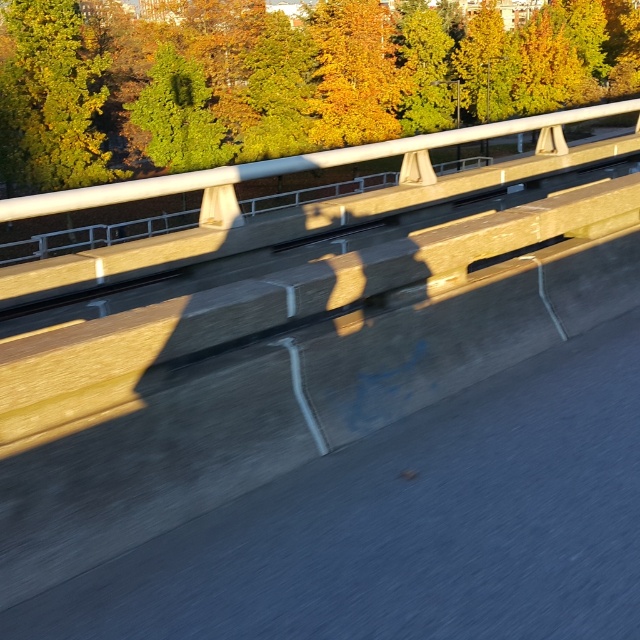
Question: Which point is closer to the camera?

Choices:
 (A) (61, 157)
 (B) (12, 161)

Answer: (B)

Question: Can you confirm if green leafy tree at upper center is smaller than green leafy tree at upper left?

Choices:
 (A) no
 (B) yes

Answer: (A)

Question: Can you confirm if green leafy tree at upper center is wider than green leafy tree at upper left?

Choices:
 (A) no
 (B) yes

Answer: (B)

Question: Which object appears farthest from the camera in this image?

Choices:
 (A) green leafy tree at upper left
 (B) green leafy tree at upper center

Answer: (B)

Question: Observing the image, what is the correct spatial positioning of green leafy tree at upper center in reference to green leafy tree at upper left?

Choices:
 (A) above
 (B) below

Answer: (A)